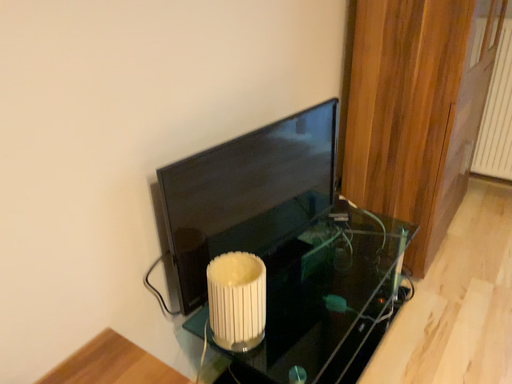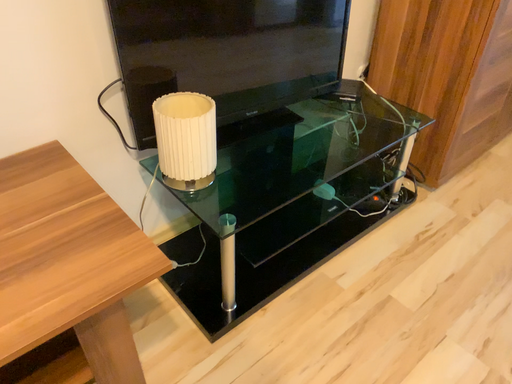
Question: How did the camera likely rotate when shooting the video?

Choices:
 (A) rotated upward
 (B) rotated downward

Answer: (B)